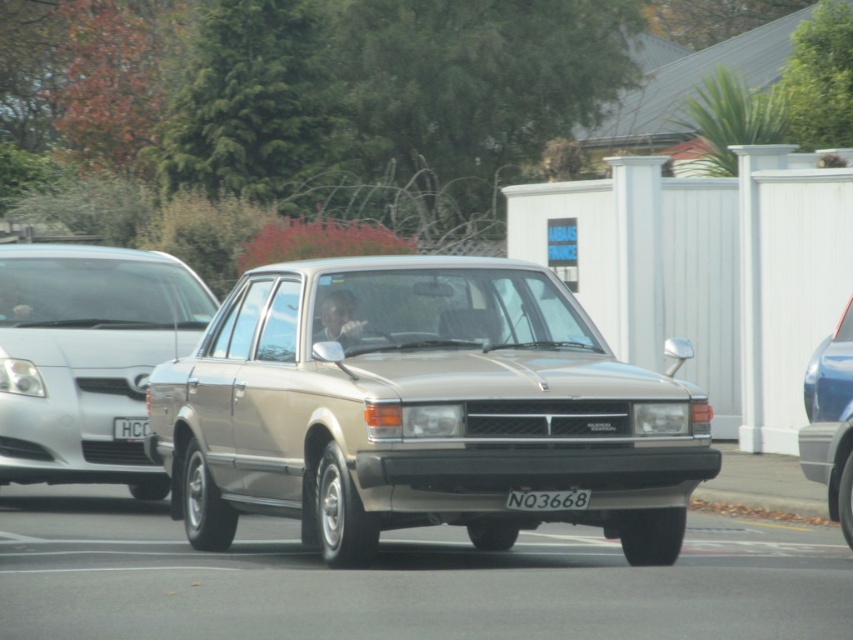
Between satin blue sedan at right and black plastic license plate at center, which one has more height?

With more height is satin blue sedan at right.

Describe the element at coordinates (830, 420) in the screenshot. The height and width of the screenshot is (640, 853). I see `satin blue sedan at right` at that location.

Find the location of a particular element. Image resolution: width=853 pixels, height=640 pixels. satin blue sedan at right is located at coordinates (830, 420).

Does black plastic license plate at center have a smaller size compared to white plastic license plate at center?

Actually, black plastic license plate at center might be larger than white plastic license plate at center.

Which is above, black plastic license plate at center or white plastic license plate at center?

Positioned higher is white plastic license plate at center.

Locate an element on the screen. This screenshot has height=640, width=853. black plastic license plate at center is located at coordinates (548, 499).

Identify the location of black plastic license plate at center. (548, 499).

Does point (476, 307) come farther from viewer compared to point (821, 358)?

No, (476, 307) is closer to viewer.

The image size is (853, 640). I want to click on satin gold sedan at center, so click(x=421, y=410).

Between point (465, 452) and point (848, 516), which one is positioned behind?

Point (848, 516)

Locate an element on the screen. The height and width of the screenshot is (640, 853). satin gold sedan at center is located at coordinates (421, 410).